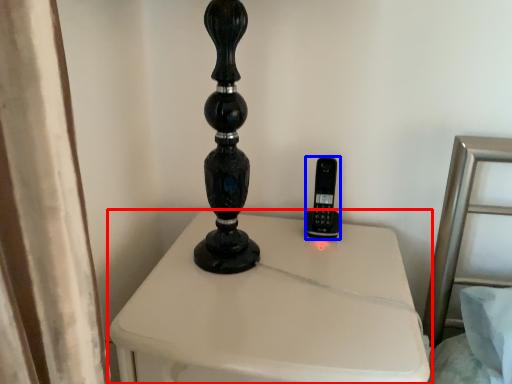
Question: Which object is closer to the camera taking this photo, furniture (highlighted by a red box) or control (highlighted by a blue box)?

Choices:
 (A) furniture
 (B) control

Answer: (A)